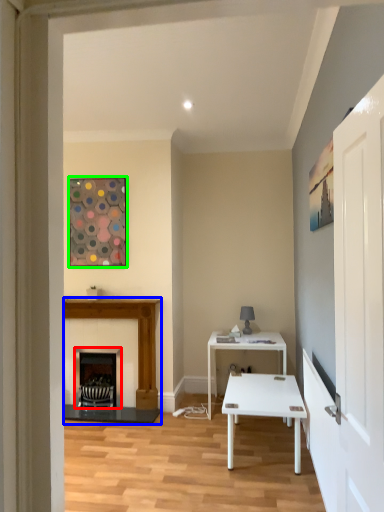
Question: Based on their relative distances, which object is farther from fireplace (highlighted by a red box)? Choose from fireplace (highlighted by a blue box) and picture frame (highlighted by a green box).

Choices:
 (A) fireplace
 (B) picture frame

Answer: (B)